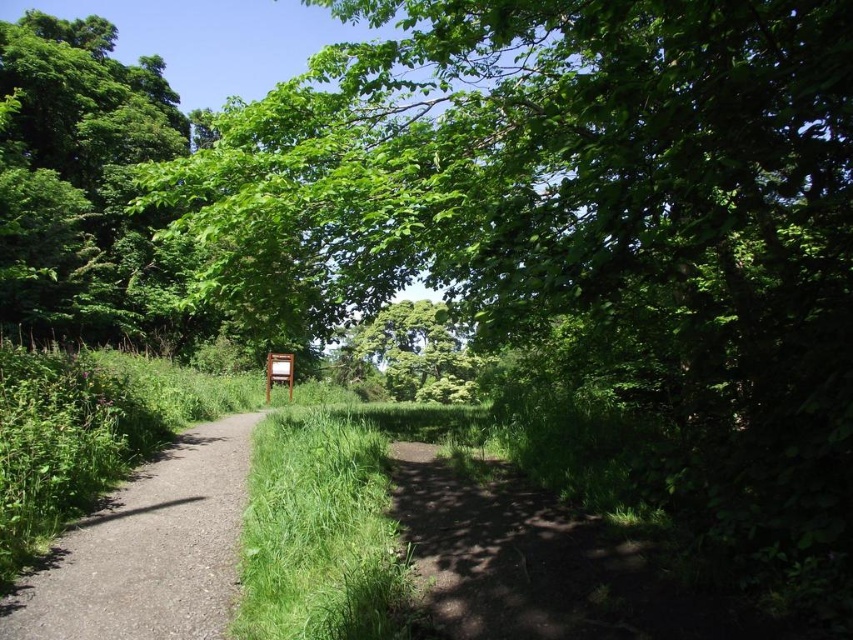
Question: Among these objects, which one is farthest from the camera?

Choices:
 (A) dirt path at center
 (B) green grass at center
 (C) green leafy tree at upper left

Answer: (C)

Question: Which of the following is the farthest from the observer?

Choices:
 (A) green leafy tree at upper left
 (B) green grass at center

Answer: (A)

Question: Can you confirm if green leafy tree at upper left is thinner than dirt path at center?

Choices:
 (A) no
 (B) yes

Answer: (A)

Question: Can you confirm if green leafy tree at upper left is positioned above green grass at center?

Choices:
 (A) no
 (B) yes

Answer: (B)

Question: Does green leafy tree at upper left have a lesser width compared to green grass at center?

Choices:
 (A) yes
 (B) no

Answer: (B)

Question: Among these objects, which one is farthest from the camera?

Choices:
 (A) green leafy tree at upper left
 (B) dirt path at center
 (C) green grass at center

Answer: (A)